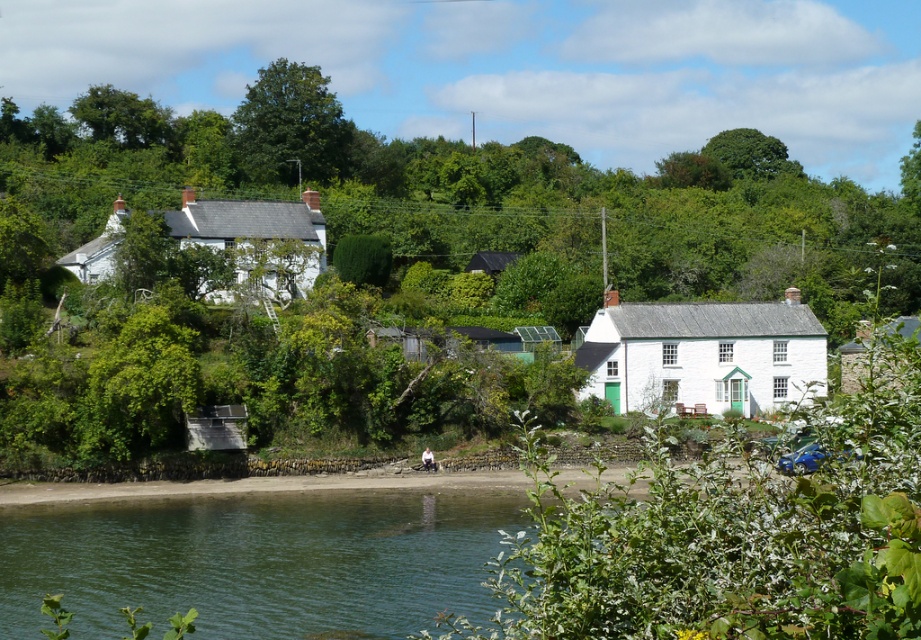
Can you confirm if green leafy tree at center is positioned above white matte house at right?

Correct, green leafy tree at center is located above white matte house at right.

Locate an element on the screen. green leafy tree at center is located at coordinates (480, 195).

Is the position of white painted stone cottage at center-right more distant than that of green leafy tree at upper center?

No, it is in front of green leafy tree at upper center.

Is white painted stone cottage at center-right closer to camera compared to green leafy tree at upper center?

Yes, it is in front of green leafy tree at upper center.

Describe the element at coordinates (703, 355) in the screenshot. I see `white painted stone cottage at center-right` at that location.

What are the coordinates of `white painted stone cottage at center-right` in the screenshot? It's located at (703, 355).

Between point (756, 369) and point (297, 211), which one is positioned in front?

Positioned in front is point (756, 369).

Which is behind, point (661, 392) or point (243, 218)?

The point (243, 218) is behind.

Is point (762, 388) closer to camera compared to point (111, 268)?

No, (762, 388) is further to viewer.

In order to click on white painted stone cottage at center-right in this screenshot , I will do `click(703, 355)`.